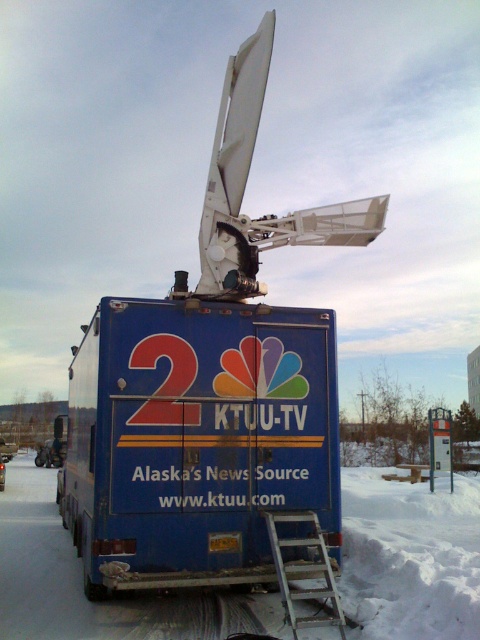
Question: Among these points, which one is farthest from the camera?

Choices:
 (A) (117, 342)
 (B) (284, 531)

Answer: (B)

Question: Can you confirm if blue matte truck at center is positioned above silver metallic ladder at lower center?

Choices:
 (A) no
 (B) yes

Answer: (B)

Question: Is blue matte truck at center positioned at the back of silver metallic ladder at lower center?

Choices:
 (A) yes
 (B) no

Answer: (A)

Question: Which object appears farthest from the camera in this image?

Choices:
 (A) blue matte truck at center
 (B) silver metallic ladder at lower center

Answer: (A)

Question: Which object is closer to the camera taking this photo?

Choices:
 (A) blue matte truck at center
 (B) silver metallic ladder at lower center

Answer: (B)

Question: Can you confirm if blue matte truck at center is smaller than silver metallic ladder at lower center?

Choices:
 (A) yes
 (B) no

Answer: (A)